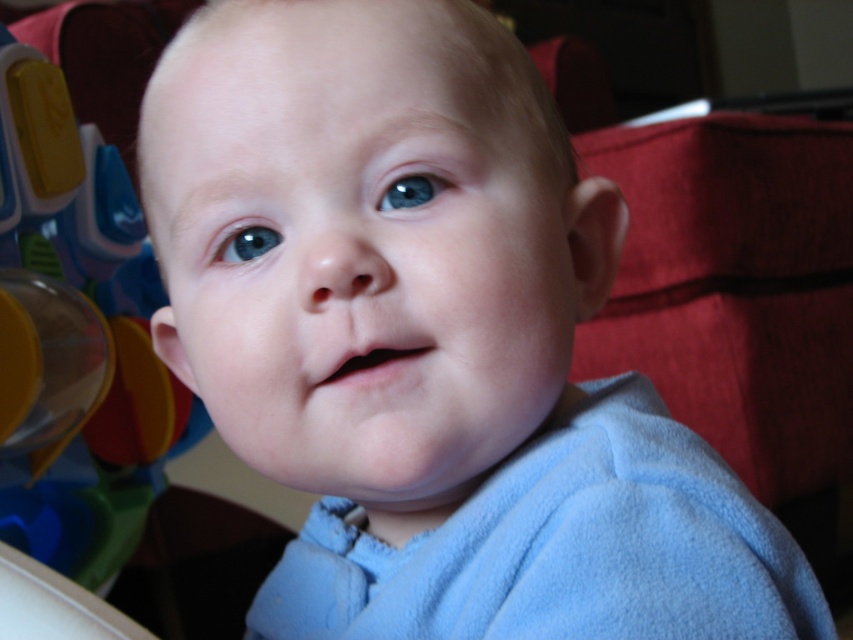
Who is more distant from viewer, (444, 179) or (258, 252)?

The point (258, 252) is more distant.

Between blue smooth eye at upper center and blue glossy eye at center, which one has less height?

Standing shorter between the two is blue glossy eye at center.

Which is in front, point (416, 186) or point (277, 234)?

Positioned in front is point (416, 186).

This screenshot has width=853, height=640. I want to click on blue smooth eye at upper center, so click(412, 189).

Who is more forward, (119, 205) or (415, 186)?

Point (415, 186) is more forward.

Is transparent plastic toy at left positioned in front of blue smooth eye at upper center?

No, it is not.

Who is more forward, (x=61, y=547) or (x=403, y=205)?

Positioned in front is point (x=403, y=205).

The width and height of the screenshot is (853, 640). I want to click on transparent plastic toy at left, so click(x=76, y=336).

Is transparent plastic toy at left to the right of blue glossy eye at center from the viewer's perspective?

In fact, transparent plastic toy at left is to the left of blue glossy eye at center.

Can you confirm if transparent plastic toy at left is shorter than blue glossy eye at center?

In fact, transparent plastic toy at left may be taller than blue glossy eye at center.

Where is `transparent plastic toy at left`? This screenshot has width=853, height=640. transparent plastic toy at left is located at coordinates (76, 336).

The height and width of the screenshot is (640, 853). I want to click on transparent plastic toy at left, so click(x=76, y=336).